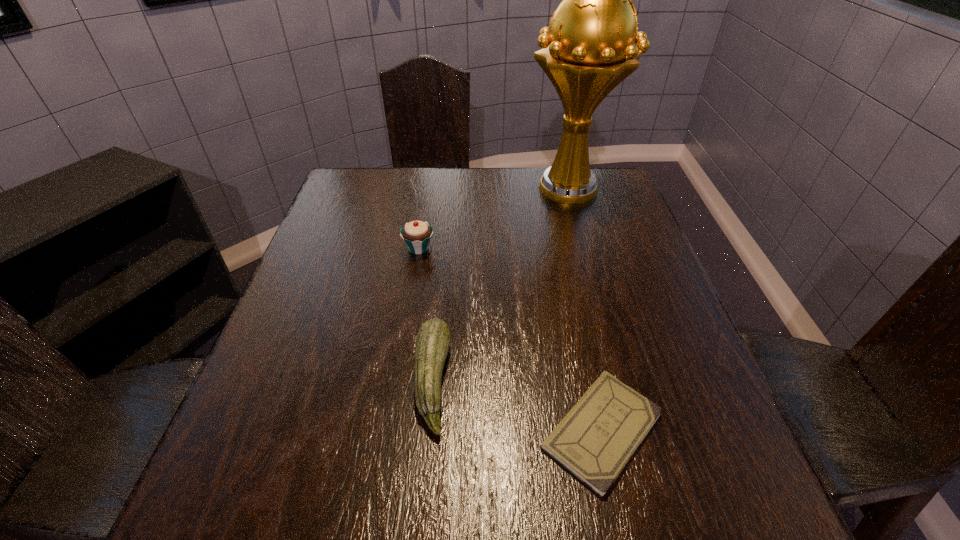
Where is `the farthest object`? the farthest object is located at coordinates (587, 50).

Where is `the tallest object`? the tallest object is located at coordinates (587, 50).

The width and height of the screenshot is (960, 540). In order to click on the third nearest object in this screenshot , I will do `click(417, 234)`.

Where is `cupcake`? The height and width of the screenshot is (540, 960). cupcake is located at coordinates (417, 234).

This screenshot has height=540, width=960. I want to click on zucchini, so click(432, 344).

Find the location of a particular element. the shortest object is located at coordinates (595, 440).

The width and height of the screenshot is (960, 540). What are the coordinates of `free space located 0.060m at the front of the trophy_cup where the globe is prominent` in the screenshot? It's located at (579, 228).

The width and height of the screenshot is (960, 540). Identify the location of vacant space located on the right of the third nearest object. (528, 248).

Where is `vacant area located 0.140m at the stem end of the zucchini`? vacant area located 0.140m at the stem end of the zucchini is located at coordinates (526, 381).

The height and width of the screenshot is (540, 960). In order to click on free location located 0.160m on the left of the shortest object in this screenshot , I will do `click(444, 430)`.